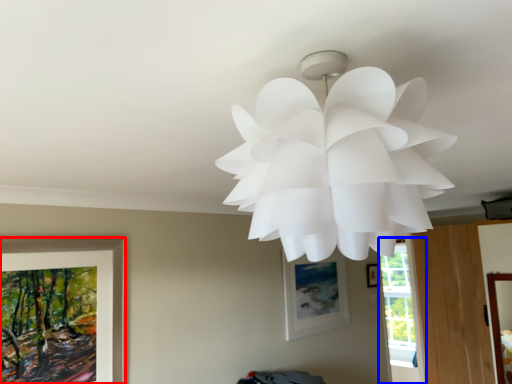
Question: Which object is further to the camera taking this photo, picture frame (highlighted by a red box) or window (highlighted by a blue box)?

Choices:
 (A) picture frame
 (B) window

Answer: (B)